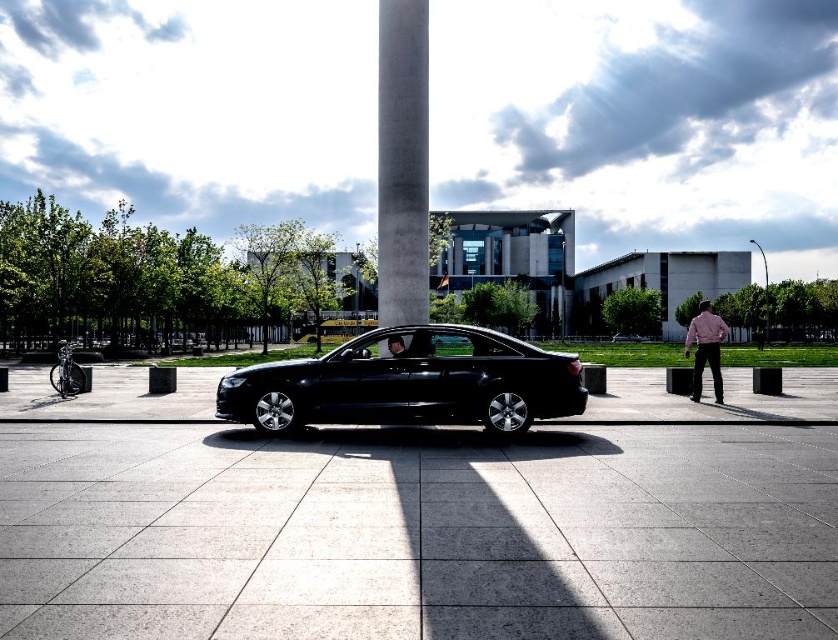
You are a delivery person trying to park your delivery van, which is 2 meters wide, in the space between the black metallic car at center and the concrete column at center. Based on the scene, can your van fit there?

The black metallic car at center is wider than the concrete column at center. However, the exact width difference isn not specified, so it is uncertain whether the space between them is wide enough for a 2 meter wide van. You should measure the space before attempting to park.

Looking at this image, you are a delivery person trying to park your vehicle in the parking lot shown in the image. You need to know if your delivery van, which is 5 meters long, can fit in the available space between the black metallic car at center and the concrete column at center. Can it fit?

The black metallic car at center is positioned under the concrete column at center, so there is no space between them for the delivery van to fit.